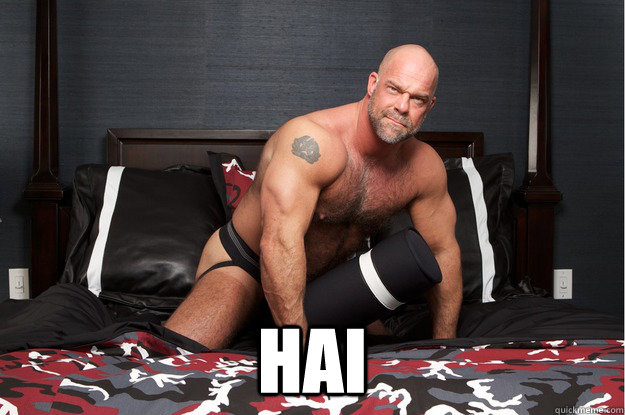
The image size is (625, 415). Find the location of `headboard`. headboard is located at coordinates (202, 147).